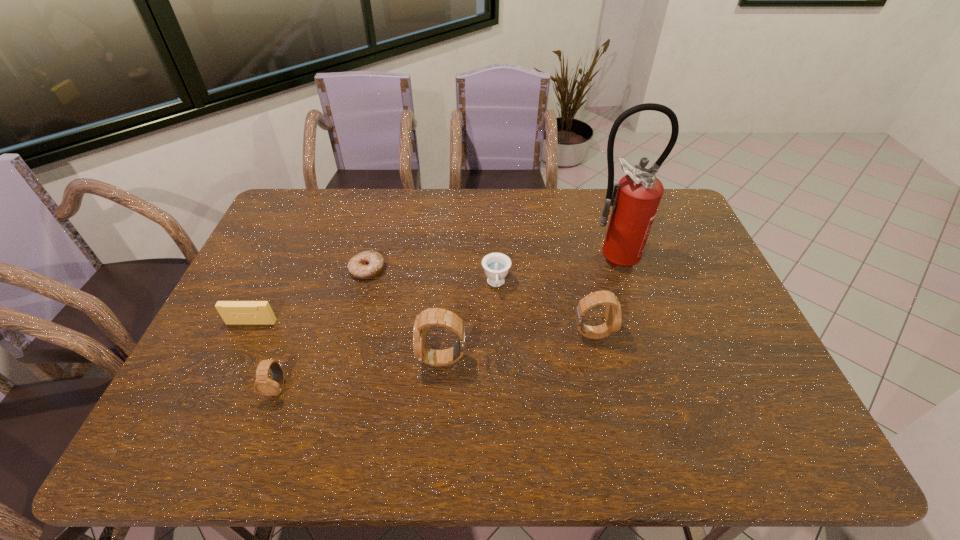
I want to click on vacant area situated on the face of the fourth object from right to left, so click(x=315, y=359).

At what (x,y) coordinates should I click in order to perform the action: click on free space located 0.110m on the face of the fourth object from right to left. Please return your answer as a coordinate pair (x, y). Image resolution: width=960 pixels, height=540 pixels. Looking at the image, I should click on (377, 359).

Where is `vacant area situated on the face of the fourth object from right to left`? This screenshot has width=960, height=540. vacant area situated on the face of the fourth object from right to left is located at coordinates (265, 359).

Where is `free spot located 0.060m on the face of the fifth shortest object`? The height and width of the screenshot is (540, 960). free spot located 0.060m on the face of the fifth shortest object is located at coordinates (633, 333).

You are a GUI agent. You are given a task and a screenshot of the screen. Output one action in this format:
    pyautogui.click(x=<x>, y=<y>)
    Task: Click on the vacant area located 0.270m on the right of the third object from left to right
    
    Given the screenshot: What is the action you would take?
    pyautogui.click(x=472, y=270)

Find the location of a particular element. This screenshot has height=540, width=960. blank space located 0.090m on the side of the third object from right to left with the handle is located at coordinates (497, 322).

Image resolution: width=960 pixels, height=540 pixels. Find the location of `vacant space located at the front of the videotape with spools`. vacant space located at the front of the videotape with spools is located at coordinates (228, 372).

Where is `vacant area situated 0.120m at the nozzle of the tallest object`? The height and width of the screenshot is (540, 960). vacant area situated 0.120m at the nozzle of the tallest object is located at coordinates (623, 302).

Find the location of a particular element. The height and width of the screenshot is (540, 960). object at the near edge is located at coordinates (263, 385).

This screenshot has height=540, width=960. Identify the location of object that is positioned at the left edge. (232, 312).